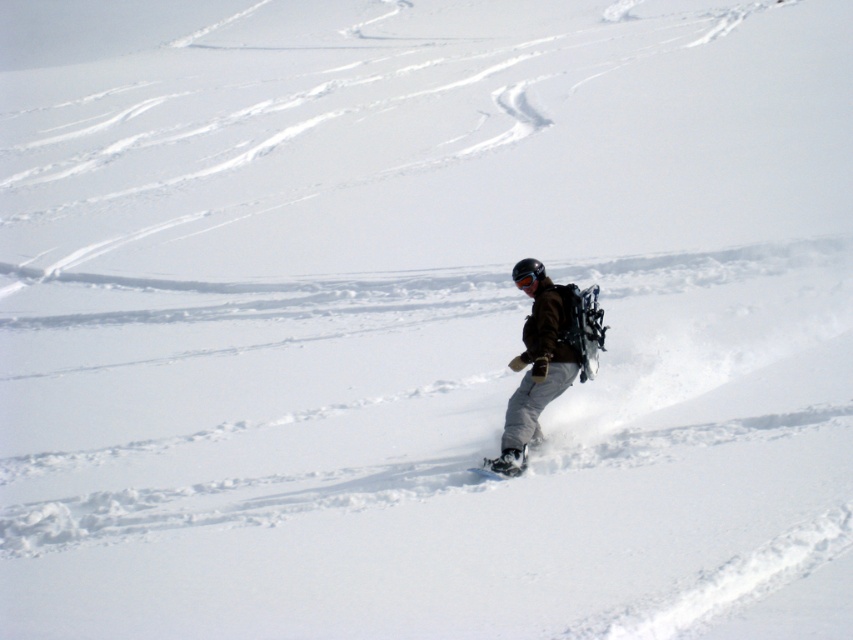
Can you confirm if dark brown jacket at center is wider than white matte snowboard at center?

Correct, the width of dark brown jacket at center exceeds that of white matte snowboard at center.

How distant is dark brown jacket at center from white matte snowboard at center?

dark brown jacket at center and white matte snowboard at center are 45.40 centimeters apart.

Between point (532, 266) and point (490, 477), which one is positioned in front?

Point (490, 477)

You are a GUI agent. You are given a task and a screenshot of the screen. Output one action in this format:
    pyautogui.click(x=<x>, y=<y>)
    Task: Click on the dark brown jacket at center
    This screenshot has width=853, height=640.
    Given the screenshot: What is the action you would take?
    pyautogui.click(x=546, y=355)